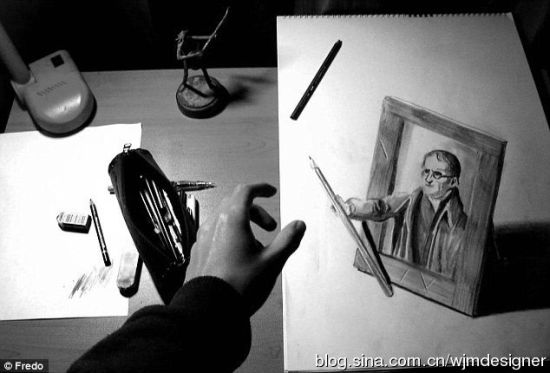
Locate an element on the screen. figurine is located at coordinates (190, 67).